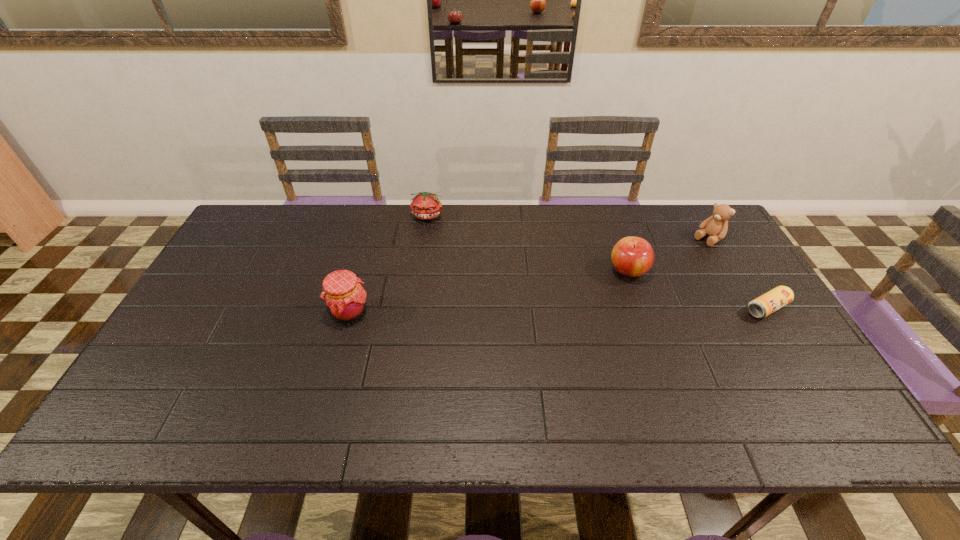
Identify the location of jam. The image size is (960, 540). (345, 299).

Image resolution: width=960 pixels, height=540 pixels. Find the location of `the shortest object`. the shortest object is located at coordinates (766, 304).

At what (x,y) coordinates should I click in order to perform the action: click on the farthest object. Please return your answer as a coordinate pair (x, y). Looking at the image, I should click on (425, 205).

The image size is (960, 540). I want to click on tomato, so click(425, 205).

Where is `apple`? apple is located at coordinates (631, 256).

Identify the location of the third object from left to right. (631, 256).

This screenshot has width=960, height=540. I want to click on the fourth nearest object, so click(716, 226).

Locate an element on the screen. free space located 0.120m on the left of the leftmost object is located at coordinates (284, 312).

The image size is (960, 540). I want to click on blank space located 0.280m on the back of the beer can, so pyautogui.click(x=720, y=233).

Where is `free space located 0.140m on the front-facing side of the tomato`? The height and width of the screenshot is (540, 960). free space located 0.140m on the front-facing side of the tomato is located at coordinates (451, 249).